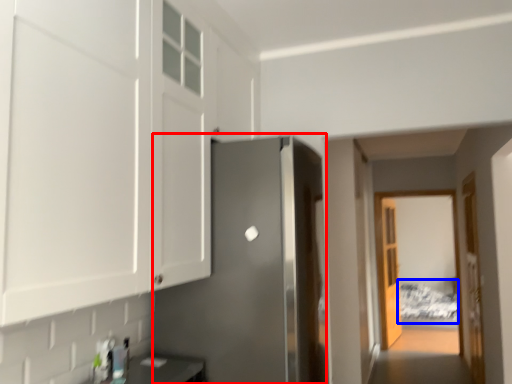
Question: Which object appears farthest to the camera in this image, door (highlighted by a red box) or bed (highlighted by a blue box)?

Choices:
 (A) door
 (B) bed

Answer: (B)